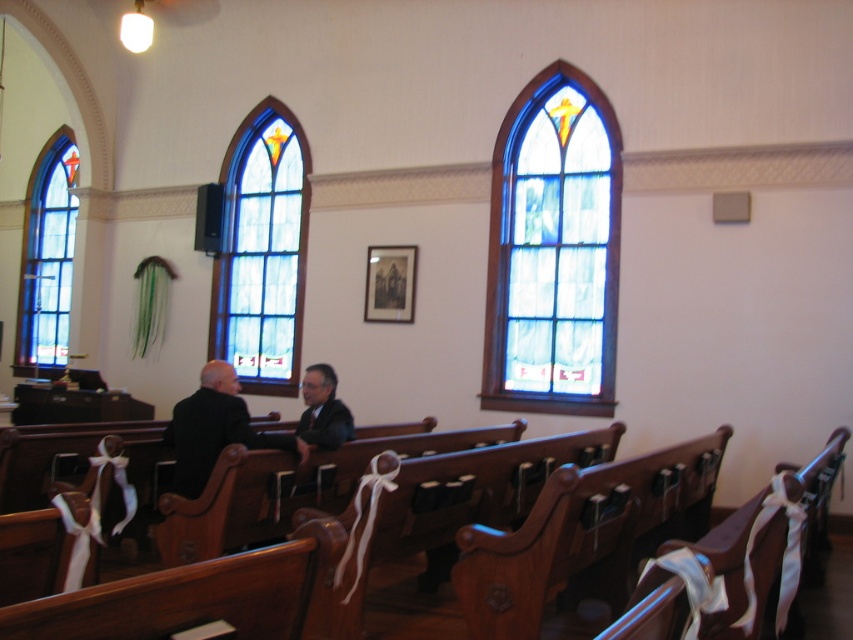
You are an interior designer planning to install a new lighting fixture. You notice the stained glass at right and the blue stained glass window at left. Which stained glass has a greater width?

The stained glass at right has a greater width than the blue stained glass window at left.

You are an architect analyzing the church layout. You notice the stained glass at right and the blue stained glass window at center. Which one is located to the right of the other?

The stained glass at right is positioned on the right side of blue stained glass window at center.